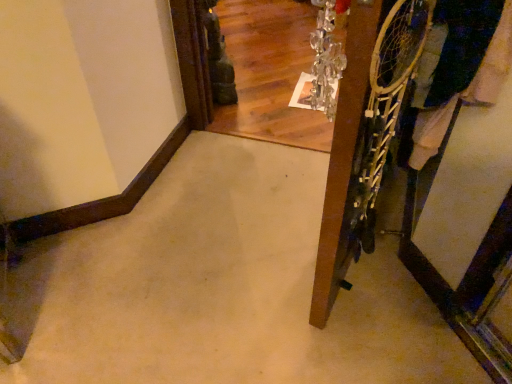
Question: Considering the positions of wooden door at right and dark blue fabric at right in the image, is wooden door at right wider or thinner than dark blue fabric at right?

Choices:
 (A) wide
 (B) thin

Answer: (B)

Question: From their relative heights in the image, would you say wooden door at right is taller or shorter than dark blue fabric at right?

Choices:
 (A) short
 (B) tall

Answer: (B)

Question: Do you think wooden door at right is within dark blue fabric at right, or outside of it?

Choices:
 (A) outside
 (B) inside

Answer: (B)

Question: Is dark blue fabric at right taller or shorter than wooden door at right?

Choices:
 (A) short
 (B) tall

Answer: (A)

Question: From the image's perspective, is dark blue fabric at right above or below wooden door at right?

Choices:
 (A) above
 (B) below

Answer: (A)

Question: From a real-world perspective, is dark blue fabric at right above or below wooden door at right?

Choices:
 (A) above
 (B) below

Answer: (B)

Question: Relative to wooden door at right, is dark blue fabric at right in front or behind?

Choices:
 (A) behind
 (B) front

Answer: (A)